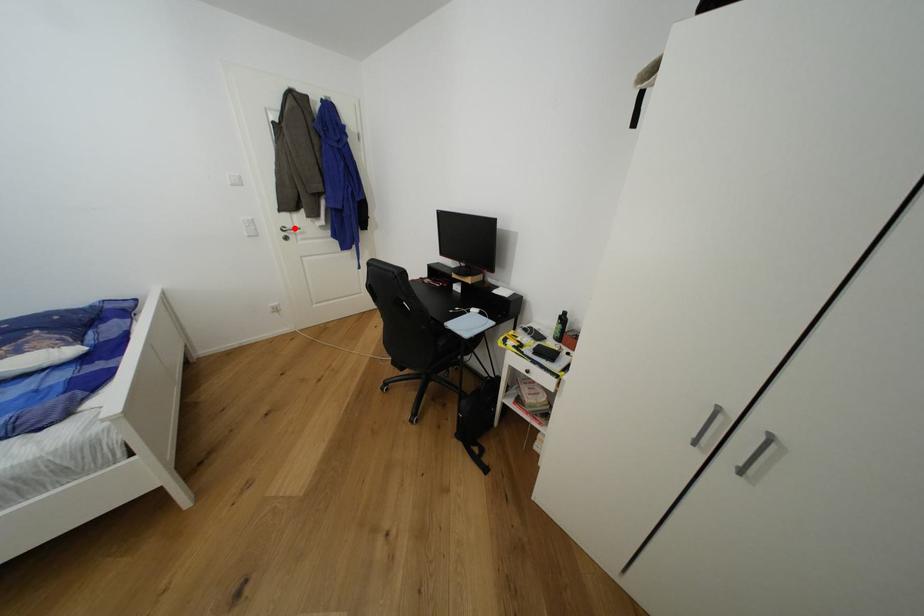
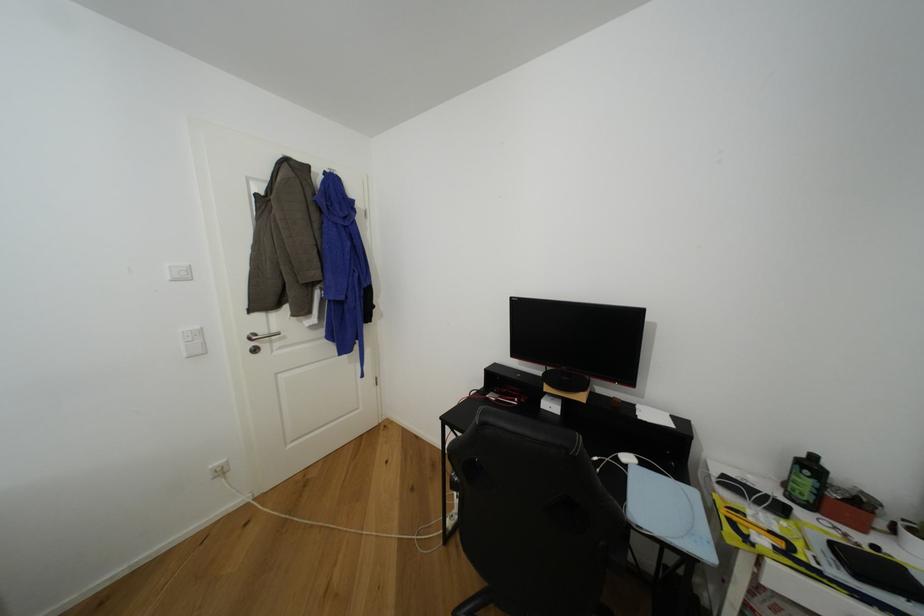
In the second image, find the point that corresponds to the highlighted location in the first image.

(268, 334)